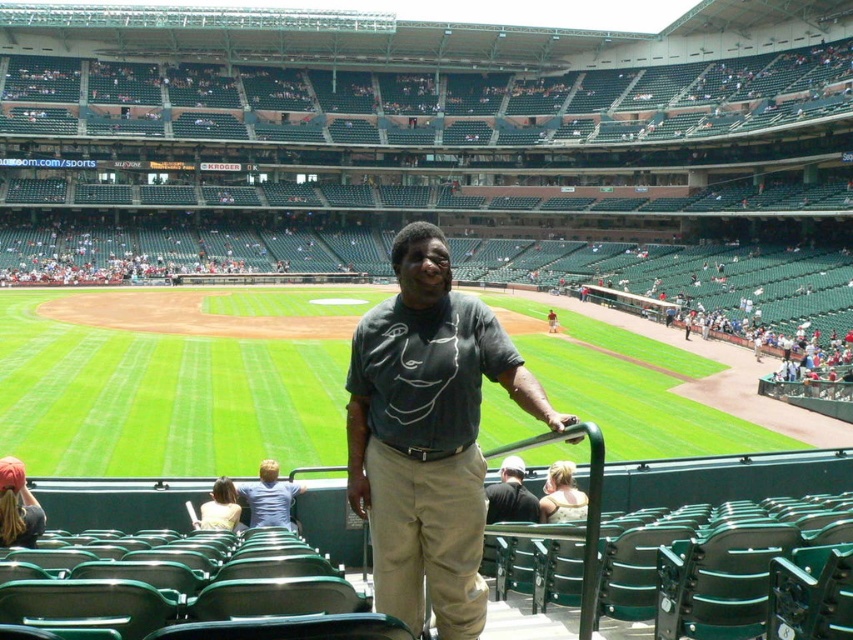
You are attending a baseball game and notice two shirts at the center of the image. The shirts are labeled as dark gray shirt at center and matte gray shirt at center. Which of these two shirts appears shorter in height?

The dark gray shirt at center appears shorter in height compared to the matte gray shirt at center as per the description provided.

You are attending a baseball game and notice two spectators in the foreground wearing a light blue shirt at center and a matte gray shirt at center. Which of these two shirts is shorter in height?

The light blue shirt at center is not as tall as matte gray shirt at center, so the light blue shirt at center is shorter in height.